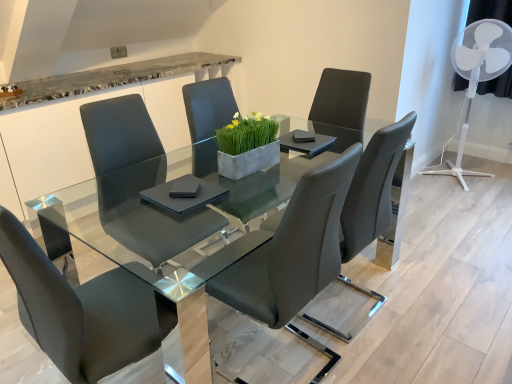
Question: Does matte black chair at center, which is the 3th chair from right to left, have a smaller size compared to matte black chair at center, the 4th chair from the right?

Choices:
 (A) yes
 (B) no

Answer: (A)

Question: From a real-world perspective, is matte black chair at center, which is the 3th chair from right to left, on matte black chair at center, the 4th chair from the right?

Choices:
 (A) yes
 (B) no

Answer: (A)

Question: Is matte black chair at center, which is the 3th chair from right to left, aimed at matte black chair at center, the 4th chair from the right?

Choices:
 (A) no
 (B) yes

Answer: (A)

Question: Considering the relative sizes of matte black chair at center, which is the 3th chair from right to left, and matte black chair at center, the first chair viewed from the left, in the image provided, is matte black chair at center, which is the 3th chair from right to left, taller than matte black chair at center, the first chair viewed from the left,?

Choices:
 (A) no
 (B) yes

Answer: (A)

Question: Is matte black chair at center, the first chair viewed from the left, inside matte black chair at center, positioned as the second chair in left-to-right order?

Choices:
 (A) yes
 (B) no

Answer: (B)

Question: Does matte black chair at center, positioned as the second chair in left-to-right order, have a lesser width compared to matte black chair at center, the 4th chair from the right?

Choices:
 (A) yes
 (B) no

Answer: (A)

Question: Considering the relative sizes of matte black chair at center, the 1th chair when ordered from right to left, and matte black chair at center, positioned as the second chair in left-to-right order, in the image provided, is matte black chair at center, the 1th chair when ordered from right to left, bigger than matte black chair at center, positioned as the second chair in left-to-right order,?

Choices:
 (A) yes
 (B) no

Answer: (A)

Question: From a real-world perspective, is matte black chair at center, the 1th chair when ordered from right to left, under matte black chair at center, positioned as the second chair in left-to-right order?

Choices:
 (A) yes
 (B) no

Answer: (A)

Question: Considering the relative sizes of matte black chair at center, the fourth chair viewed from the left, and matte black chair at center, which is the 3th chair from right to left, in the image provided, is matte black chair at center, the fourth chair viewed from the left, taller than matte black chair at center, which is the 3th chair from right to left,?

Choices:
 (A) no
 (B) yes

Answer: (B)

Question: Does matte black chair at center, the fourth chair viewed from the left, appear on the right side of matte black chair at center, which is the 3th chair from right to left?

Choices:
 (A) no
 (B) yes

Answer: (B)

Question: Is matte black chair at center, the fourth chair viewed from the left, thinner than matte black chair at center, positioned as the second chair in left-to-right order?

Choices:
 (A) no
 (B) yes

Answer: (A)

Question: Is matte black chair at center, which is the 3th chair from right to left, at the back of matte black chair at center, the 1th chair when ordered from right to left?

Choices:
 (A) yes
 (B) no

Answer: (B)

Question: Can you confirm if matte black chair at center, the first chair viewed from the left, is positioned to the right of transparent glass table at center?

Choices:
 (A) no
 (B) yes

Answer: (A)